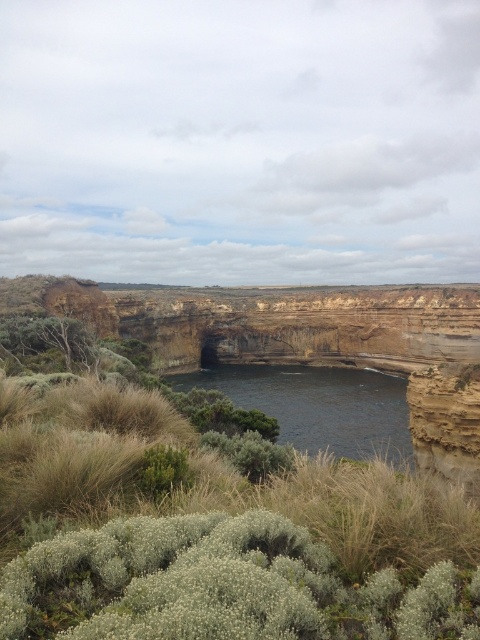
Identify the location of green grassy shrubs at center. The width and height of the screenshot is (480, 640). (213, 528).

Is green grassy shrubs at center shorter than dark blue water at center?

In fact, green grassy shrubs at center may be taller than dark blue water at center.

At what (x,y) coordinates should I click in order to perform the action: click on green grassy shrubs at center. Please return your answer as a coordinate pair (x, y). Image resolution: width=480 pixels, height=640 pixels. Looking at the image, I should click on (213, 528).

In order to click on green grassy shrubs at center in this screenshot , I will do `click(213, 528)`.